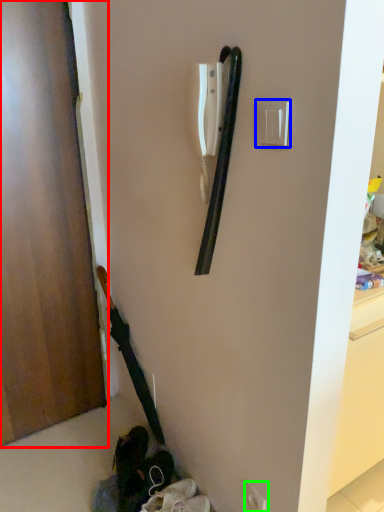
Question: Based on their relative distances, which object is nearer to door (highlighted by a red box)? Choose from light switch (highlighted by a blue box) and electric outlet (highlighted by a green box).

Choices:
 (A) light switch
 (B) electric outlet

Answer: (A)